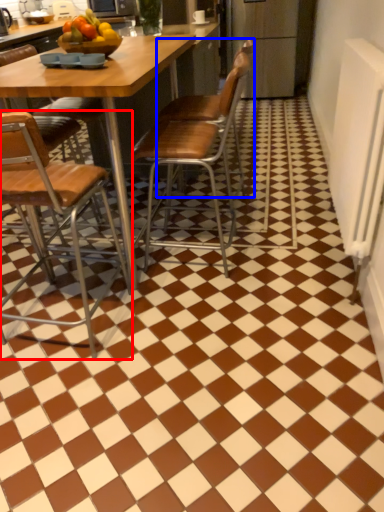
Question: Which object appears farthest to the camera in this image, chair (highlighted by a red box) or chair (highlighted by a blue box)?

Choices:
 (A) chair
 (B) chair

Answer: (B)